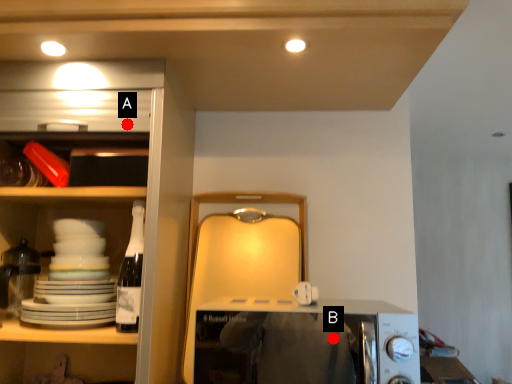
Question: Two points are circled on the image, labeled by A and B beside each circle. Which point appears closest to the camera in this image?

Choices:
 (A) A is closer
 (B) B is closer

Answer: (B)